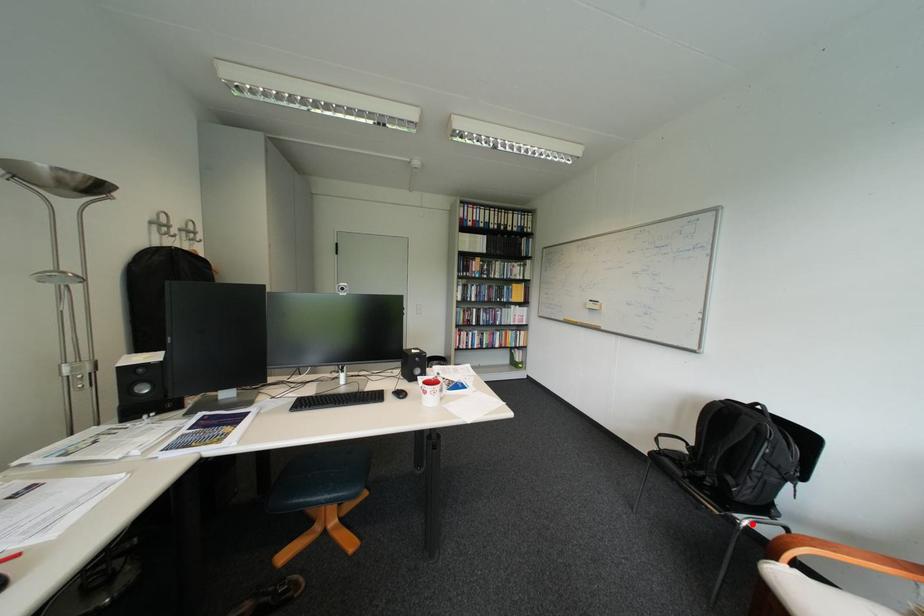
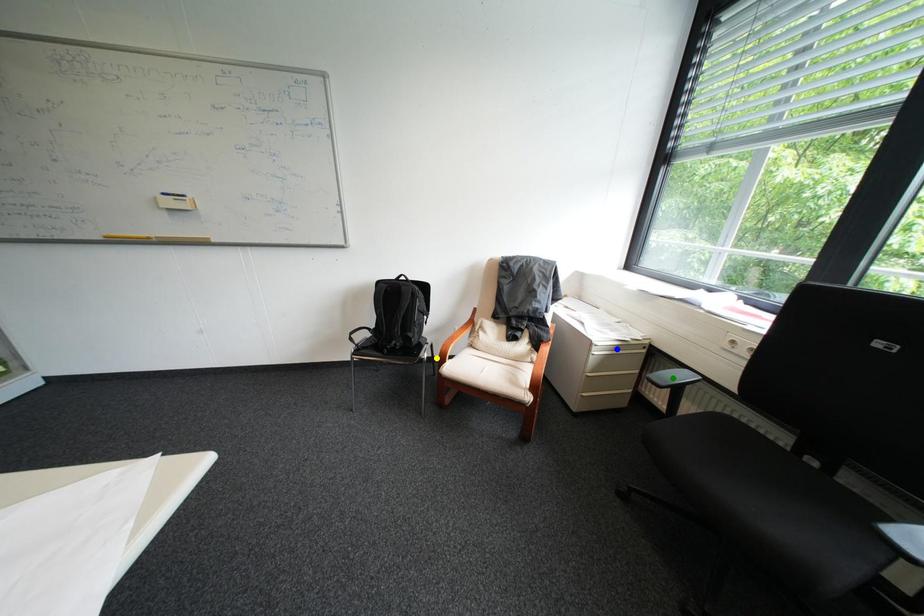
Question: I am providing you with two images of the same scene from different viewpoints. A red point is marked on the first image. You are given multiple points on the second image. Which point in image 2 represents the same 3d spot as the red point in image 1?

Choices:
 (A) green point
 (B) blue point
 (C) yellow point

Answer: (C)